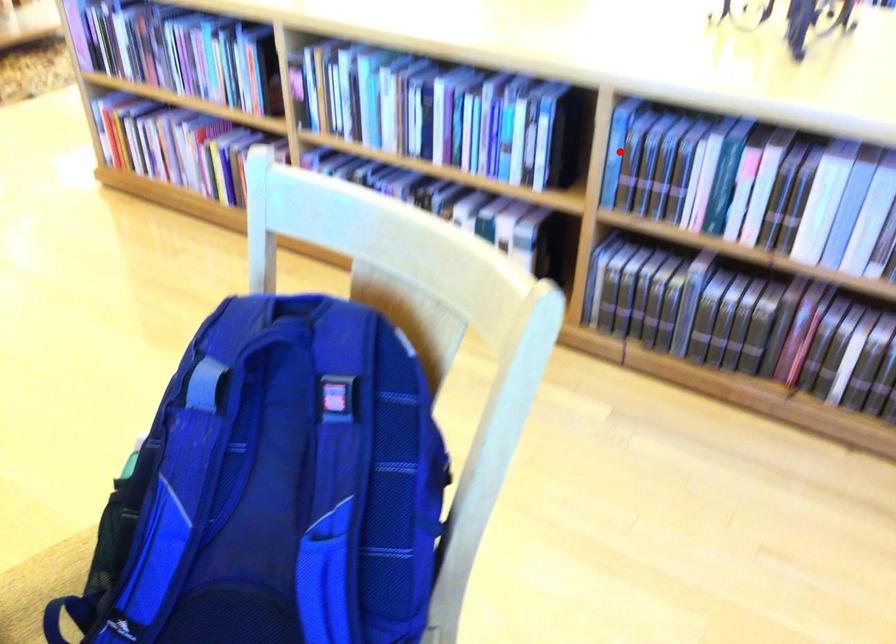
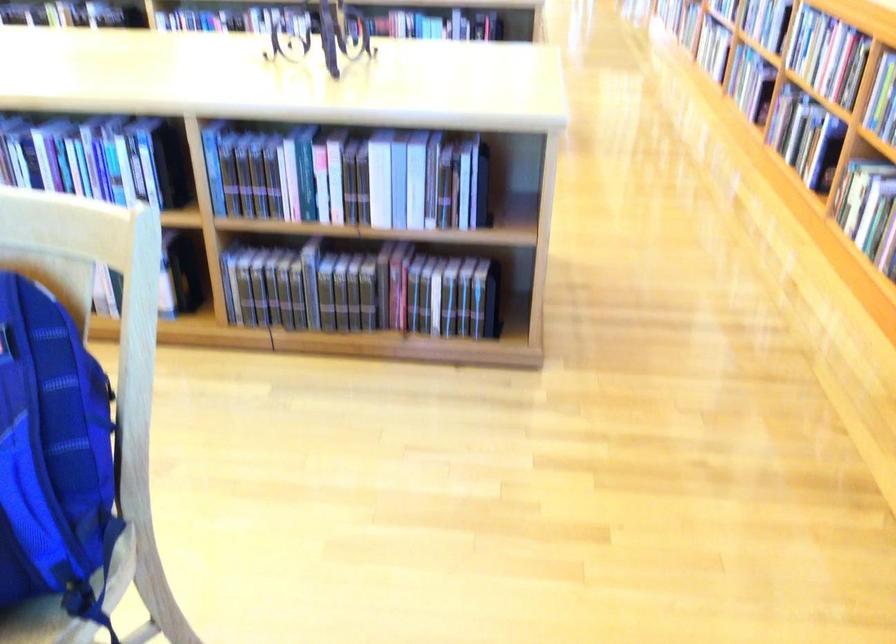
Question: I am providing you with two images of the same scene from different viewpoints. In image1, a red point is highlighted. Considering the same 3D point in image2, which of the following is correct?

Choices:
 (A) It is closer
 (B) It is farther

Answer: (B)